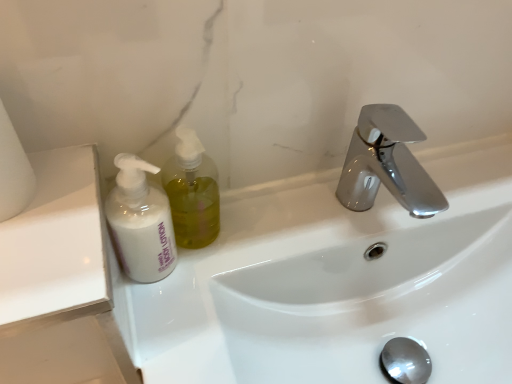
Question: Is white matte toilet paper at left further to the viewer compared to white matte lotion at left?

Choices:
 (A) no
 (B) yes

Answer: (A)

Question: Can you confirm if white matte toilet paper at left is positioned to the right of white matte lotion at left?

Choices:
 (A) yes
 (B) no

Answer: (B)

Question: Can you confirm if white matte toilet paper at left is wider than white matte lotion at left?

Choices:
 (A) no
 (B) yes

Answer: (B)

Question: Is white matte toilet paper at left to the left of white matte lotion at left from the viewer's perspective?

Choices:
 (A) yes
 (B) no

Answer: (A)

Question: Is white matte toilet paper at left far from white matte lotion at left?

Choices:
 (A) yes
 (B) no

Answer: (B)

Question: Considering the relative sizes of white matte toilet paper at left and white matte lotion at left in the image provided, is white matte toilet paper at left smaller than white matte lotion at left?

Choices:
 (A) no
 (B) yes

Answer: (A)

Question: Is the depth of white matte lotion at left greater than that of white glossy sink at center?

Choices:
 (A) yes
 (B) no

Answer: (A)

Question: Is white matte lotion at left aimed at white glossy sink at center?

Choices:
 (A) yes
 (B) no

Answer: (B)

Question: Is white matte lotion at left shorter than white glossy sink at center?

Choices:
 (A) yes
 (B) no

Answer: (A)

Question: Is white matte lotion at left positioned in front of white glossy sink at center?

Choices:
 (A) yes
 (B) no

Answer: (B)

Question: From the image's perspective, is white matte lotion at left below white glossy sink at center?

Choices:
 (A) no
 (B) yes

Answer: (A)

Question: Would you say white glossy sink at center is part of white matte lotion at left's contents?

Choices:
 (A) no
 (B) yes

Answer: (A)

Question: From a real-world perspective, is white matte lotion at left under translucent yellow liquid at left?

Choices:
 (A) no
 (B) yes

Answer: (B)